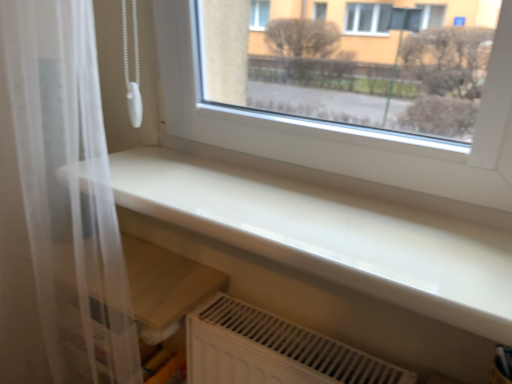
Identify the location of white sheer curtain at left. (68, 191).

Measure the distance between point (42, 172) and camera.

A distance of 27.09 inches exists between point (42, 172) and camera.

The height and width of the screenshot is (384, 512). Identify the location of white sheer curtain at left. (68, 191).

Is white sheer curtain at left inside white plastic radiator at lower center?

No, white plastic radiator at lower center does not contain white sheer curtain at left.

Considering the positions of objects white plastic radiator at lower center and white sheer curtain at left in the image provided, who is more to the left, white plastic radiator at lower center or white sheer curtain at left?

white sheer curtain at left is more to the left.

Which point is more forward, (226, 354) or (91, 105)?

Positioned in front is point (91, 105).

Can you confirm if white plastic radiator at lower center is bigger than white sheer curtain at left?

No, white plastic radiator at lower center is not bigger than white sheer curtain at left.

Are white glossy counter top at lower center and white sheer curtain at left beside each other?

No, white glossy counter top at lower center is not next to white sheer curtain at left.

Who is more distant, white glossy counter top at lower center or white sheer curtain at left?

Positioned behind is white sheer curtain at left.

Considering the sizes of objects white glossy counter top at lower center and white sheer curtain at left in the image provided, who is shorter, white glossy counter top at lower center or white sheer curtain at left?

white glossy counter top at lower center is shorter.

Does white glossy counter top at lower center turn towards white sheer curtain at left?

No, white glossy counter top at lower center does not turn towards white sheer curtain at left.

The width and height of the screenshot is (512, 384). What are the coordinates of `shower curtain on the left side of white plastic radiator at lower center` in the screenshot? It's located at (68, 191).

Which is behind, point (89, 56) or point (248, 362)?

Positioned behind is point (248, 362).

Is white sheer curtain at left to the left or to the right of white plastic radiator at lower center in the image?

In the image, white sheer curtain at left appears on the left side of white plastic radiator at lower center.

From the image's perspective, which object appears higher, white sheer curtain at left or white glossy counter top at lower center?

white glossy counter top at lower center, from the image's perspective.

From the picture: Which of these two, white sheer curtain at left or white glossy counter top at lower center, stands taller?

white sheer curtain at left.

The image size is (512, 384). In order to click on shower curtain behind the white glossy counter top at lower center in this screenshot , I will do `click(68, 191)`.

Does white sheer curtain at left have a greater width compared to white glossy counter top at lower center?

In fact, white sheer curtain at left might be narrower than white glossy counter top at lower center.

Is white plastic radiator at lower center far from white glossy counter top at lower center?

No, white plastic radiator at lower center is not far from white glossy counter top at lower center.

Where is `air conditioning that is below the white glossy counter top at lower center (from the image's perspective)`? The height and width of the screenshot is (384, 512). air conditioning that is below the white glossy counter top at lower center (from the image's perspective) is located at coordinates (273, 350).

Considering the points (208, 359) and (310, 268), which point is behind, point (208, 359) or point (310, 268)?

Point (208, 359)

How far apart are white plastic radiator at lower center and white glossy counter top at lower center?

A distance of 26.56 centimeters exists between white plastic radiator at lower center and white glossy counter top at lower center.

Would you consider white glossy counter top at lower center to be distant from white plastic radiator at lower center?

No, white glossy counter top at lower center is not far from white plastic radiator at lower center.

Can you confirm if white glossy counter top at lower center is wider than white plastic radiator at lower center?

Yes.

Could you tell me if white glossy counter top at lower center is turned towards white plastic radiator at lower center?

No.

Is white glossy counter top at lower center further to the viewer compared to white plastic radiator at lower center?

No, white glossy counter top at lower center is closer to the camera.

Where is `air conditioning on the right of white sheer curtain at left`? The width and height of the screenshot is (512, 384). air conditioning on the right of white sheer curtain at left is located at coordinates [273, 350].

Locate an element on the screen. The image size is (512, 384). counter top above the white sheer curtain at left (from the image's perspective) is located at coordinates (331, 235).

Estimate the real-world distances between objects in this image. Which object is closer to white sheer curtain at left, white plastic radiator at lower center or white glossy counter top at lower center?

white glossy counter top at lower center lies closer to white sheer curtain at left than the other object.

Considering their positions, is white glossy counter top at lower center positioned closer to white plastic radiator at lower center than white sheer curtain at left?

white glossy counter top at lower center is positioned closer to the anchor white plastic radiator at lower center.

Looking at the image, which one is located closer to white glossy counter top at lower center, white sheer curtain at left or white plastic radiator at lower center?

white sheer curtain at left.

Looking at this image, from the image, which object appears to be farther from white glossy counter top at lower center, white plastic radiator at lower center or white sheer curtain at left?

white plastic radiator at lower center is positioned further to the anchor white glossy counter top at lower center.

Based on their spatial positions, is white glossy counter top at lower center or white plastic radiator at lower center further from white sheer curtain at left?

white plastic radiator at lower center.

Estimate the real-world distances between objects in this image. Which object is further from white plastic radiator at lower center, white sheer curtain at left or white glossy counter top at lower center?

The object further to white plastic radiator at lower center is white sheer curtain at left.

The height and width of the screenshot is (384, 512). I want to click on counter top between white sheer curtain at left and white plastic radiator at lower center, so pos(331,235).